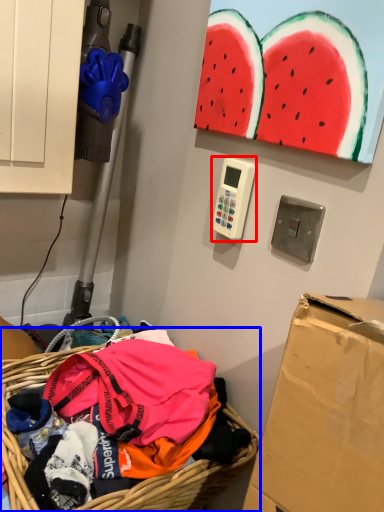
Question: Which of the following is the closest to the observer, scale (highlighted by a red box) or basket (highlighted by a blue box)?

Choices:
 (A) scale
 (B) basket

Answer: (B)